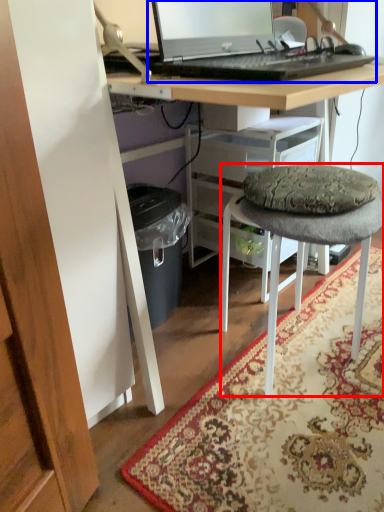
Question: Which point is further to the camera, stool (highlighted by a red box) or computer (highlighted by a blue box)?

Choices:
 (A) stool
 (B) computer

Answer: (A)